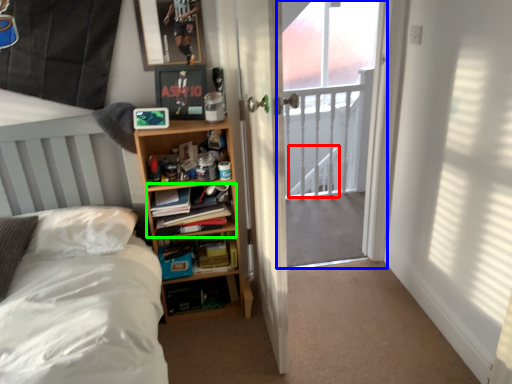
Question: Considering the real-world distances, which object is farthest from stairwell (highlighted by a red box)? screen door (highlighted by a blue box) or book (highlighted by a green box)?

Choices:
 (A) screen door
 (B) book

Answer: (B)